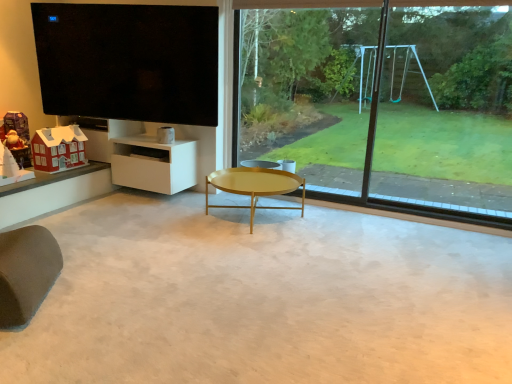
The image size is (512, 384). Identify the location of vacant space that is in between gold metallic coffee table at center and brown fabric swivel chair at lower left. (162, 254).